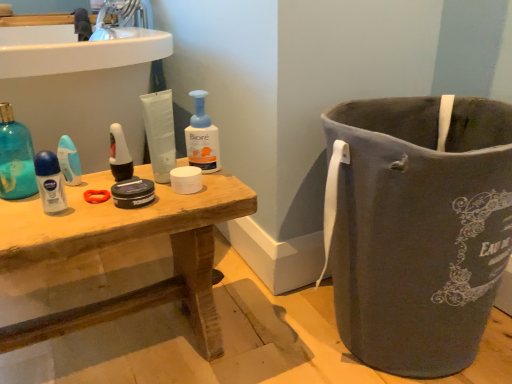
The image size is (512, 384). What are the coordinates of `vacant area that is in front of white matte toothbrush at center` in the screenshot? It's located at (88, 206).